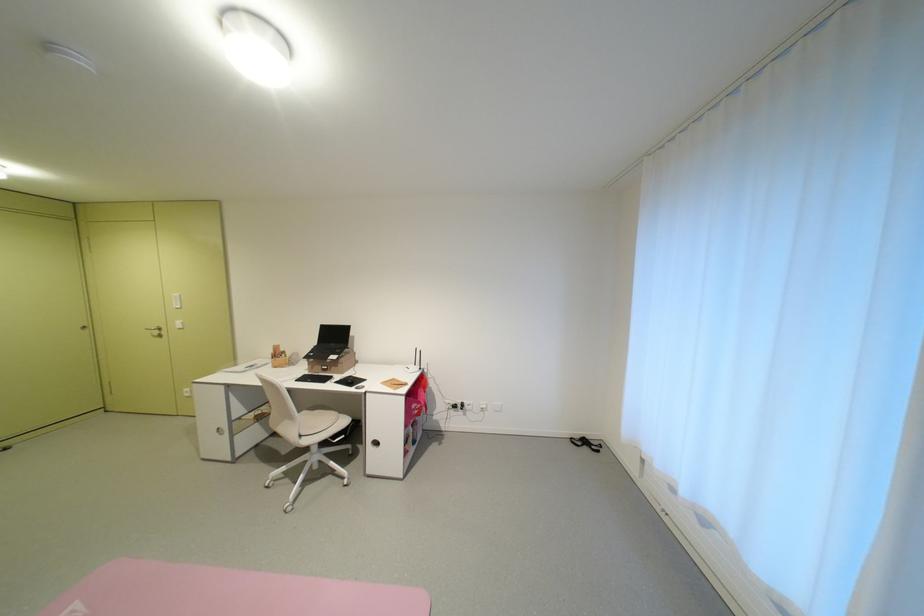
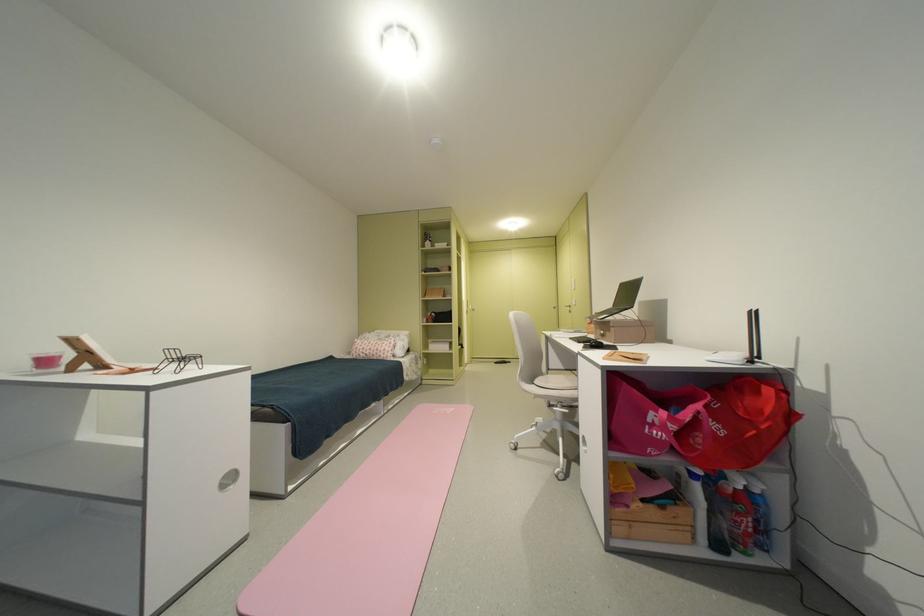
In the second image, find the point that corresponds to (359,381) in the first image.

(602, 342)